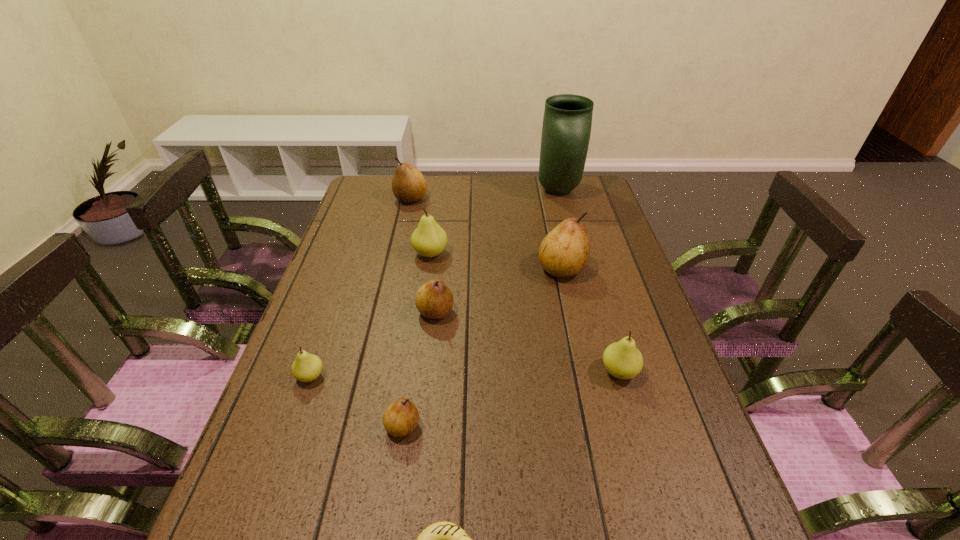
Identify the location of the tallest object. The image size is (960, 540). (567, 121).

At what (x,y) coordinates should I click in order to perform the action: click on vase. Please return your answer as a coordinate pair (x, y). Looking at the image, I should click on (567, 121).

This screenshot has width=960, height=540. Find the location of `the tallest pear`. the tallest pear is located at coordinates (565, 251).

Find the location of `the second farthest brown pear`. the second farthest brown pear is located at coordinates (565, 251).

Identify the location of the second biggest brown pear. (409, 186).

Image resolution: width=960 pixels, height=540 pixels. Identify the location of the farthest pear. (409, 186).

At what (x,y) coordinates should I click in order to perform the action: click on the biggest green pear. Please return your answer as a coordinate pair (x, y). This screenshot has width=960, height=540. Looking at the image, I should click on (429, 240).

Identify the location of the farthest green pear. (429, 240).

The image size is (960, 540). I want to click on the second smallest brown pear, so click(434, 300).

Where is `the fourth nearest pear`? This screenshot has height=540, width=960. the fourth nearest pear is located at coordinates point(434,300).